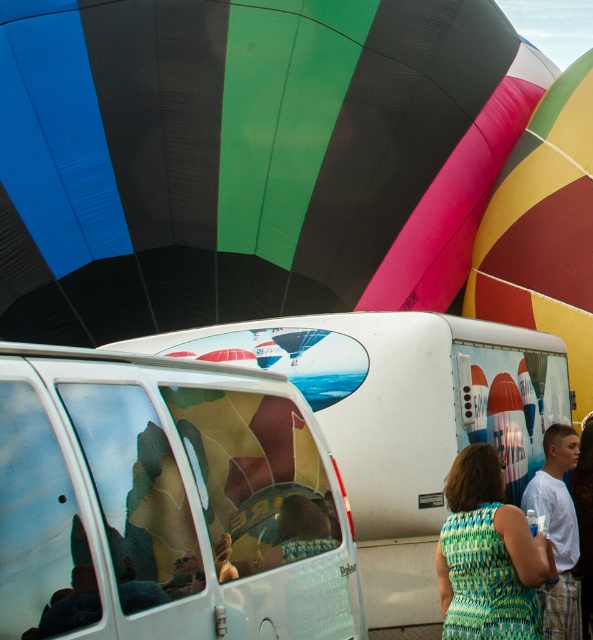
You are a photographer trying to capture the entire scene of the hot air balloon festival. You notice two vehicles in the image, the white glossy minivan at center and the white glossy van at center. Which vehicle would require less space to park in a tight spot?

The white glossy minivan at center is thinner than the white glossy van at center, so it would require less space to park in a tight spot.

You are a photographer at the hot air balloon festival. You want to capture a photo that includes both the rubberized yellow balloon at upper right and the white cotton shirt at lower right. Which object should you focus on first to ensure both are in frame?

You should focus on the rubberized yellow balloon at upper right first because it is larger in size than the white cotton shirt at lower right, so it will occupy more space in the photo and help frame the composition better.

You are standing in front of the white van with the mural and want to take a photo of the rubberized yellow balloon at upper right. If your camera has a maximum focus range of 40 feet, will you be able to capture a clear image of the balloon?

The rubberized yellow balloon at upper right is 41.20 feet away from the viewer. Since the camera can only focus up to 40 feet, it won not be able to capture a clear image of the balloon.